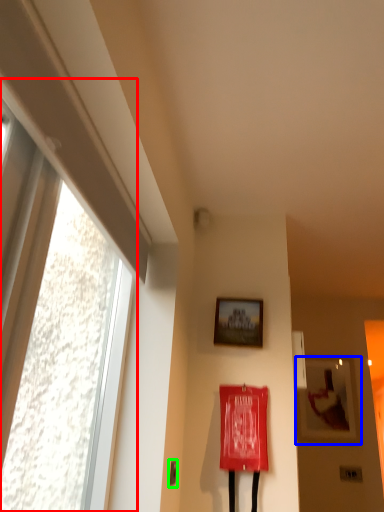
Question: Which is farther away from window (highlighted by a red box)? picture frame (highlighted by a blue box) or door handle (highlighted by a green box)?

Choices:
 (A) picture frame
 (B) door handle

Answer: (A)